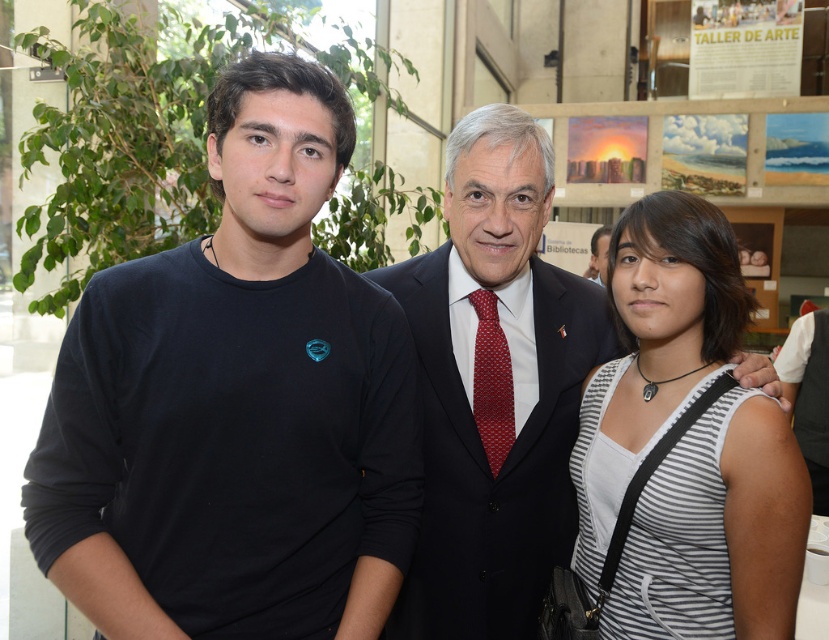
You are a photographer adjusting the camera focus. The camera can only focus on objects within a 10 inch range. You need to capture both the white striped tank top at right and the red textured tie at center in sharp focus. Is this possible?

The distance between the white striped tank top at right and the red textured tie at center is 12.91 inches, which exceeds the camera focus range of 10 inches. Therefore, it will be difficult to have both in sharp focus simultaneously.

You are an observer standing in front of the group. Which clothing item, the black matte shirt at left or the white striped tank top at right, is positioned higher on the person wearing it?

The black matte shirt at left is positioned higher than the white striped tank top at right.

You are an artist trying to paint the group based on the image. You need to decide the vertical positioning of the two people wearing the black matte shirt at left and the white striped tank top at right. Which one should you paint taller?

The black matte shirt at left should be painted taller than the white striped tank top at right because the black matte shirt at left is taller than white striped tank top at right.